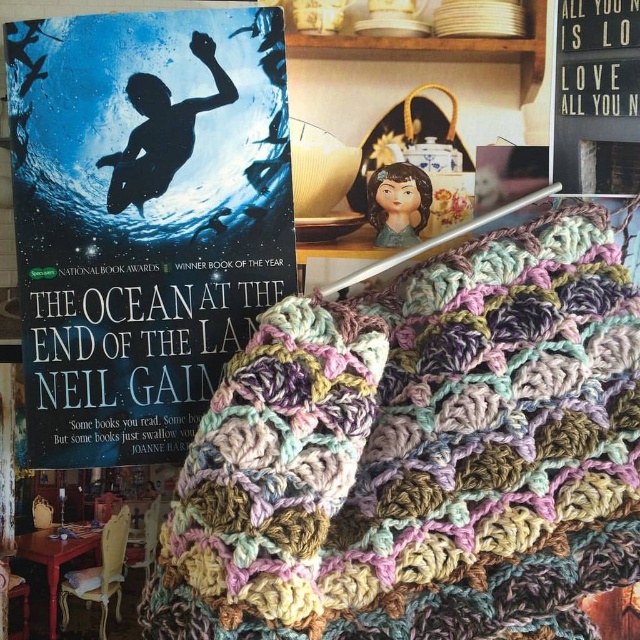
Looking at this image, you are a customer in a store and you want to pick up the multicolored crocheted blanket at center. The store has a rule that you must be at least 80 centimeters away from the display to prevent damage. Can you safely reach the blanket without violating the rule?

The multicolored crocheted blanket at center is only 77.87 centimeters away from the viewer, which is less than the required 80 centimeters. Therefore, reaching for it would violate the store rule.

You are an interior designer arranging items in the scene. You need to place a new decorative item behind the matte paper book at left. Can you do this without moving the wooden signboard at upper right?

The matte paper book at left is in front of the wooden signboard at upper right, so placing an item behind the matte paper book at left would require moving the wooden signboard at upper right to make space. Therefore, it is not possible to place the new decorative item behind the matte paper book at left without moving the wooden signboard at upper right.

You are an interior designer arranging items in the scene. You need to place a new decorative item between the multicolored crocheted blanket at center and the wooden signboard at upper right. Based on their current positions, where should you place the new item to ensure it is between them?

The multicolored crocheted blanket at center is positioned on the left side of the wooden signboard at upper right, so placing the new item to the right of the blanket but to the left of the signboard would place it between them.